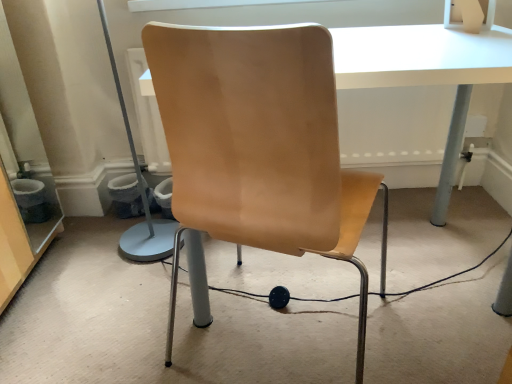
This screenshot has width=512, height=384. In order to click on free spot below white glossy table at center (from a real-world perspective) in this screenshot , I will do `click(399, 271)`.